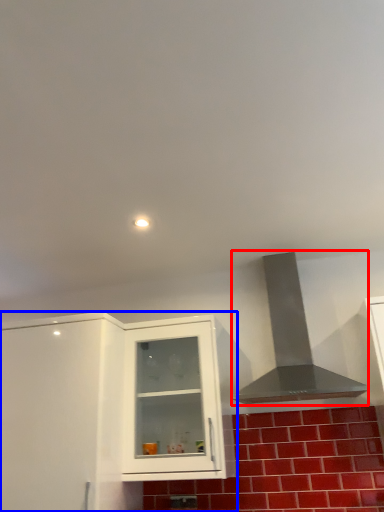
Question: Among these objects, which one is nearest to the camera, vent (highlighted by a red box) or cabinetry (highlighted by a blue box)?

Choices:
 (A) vent
 (B) cabinetry

Answer: (B)